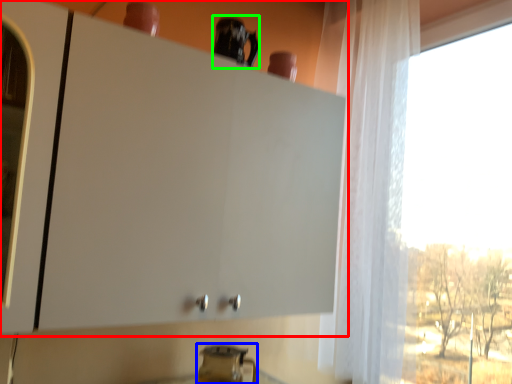
Question: Considering the real-world distances, which object is closest to cabinetry (highlighted by a red box)? appliance (highlighted by a blue box) or appliance (highlighted by a green box).

Choices:
 (A) appliance
 (B) appliance

Answer: (B)